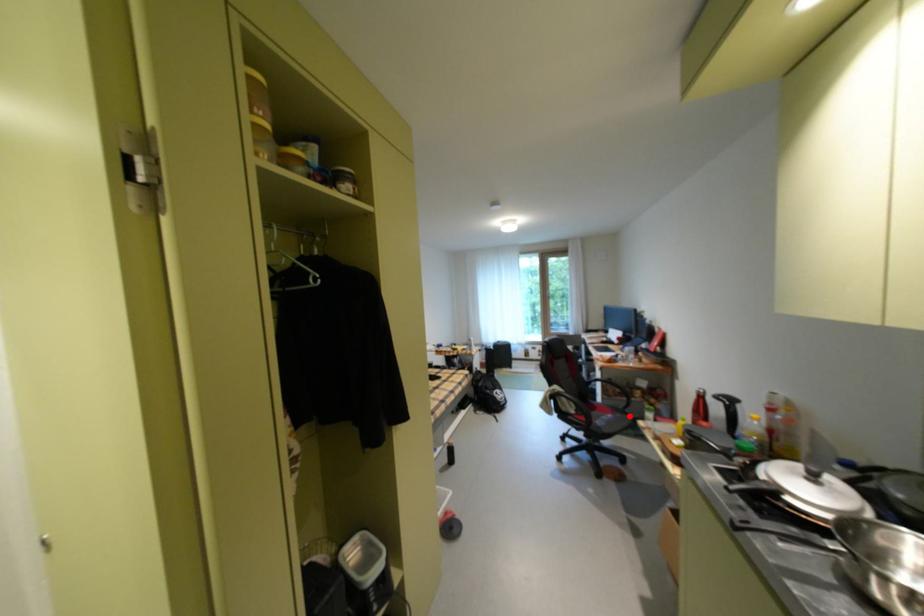
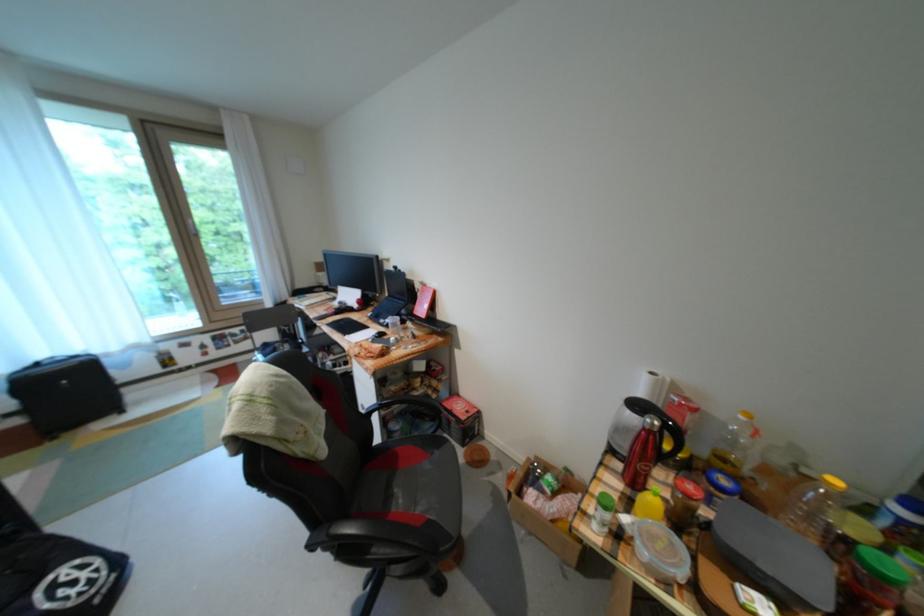
Locate, in the second image, the point that corresponds to the highlighted location in the first image.

(446, 455)